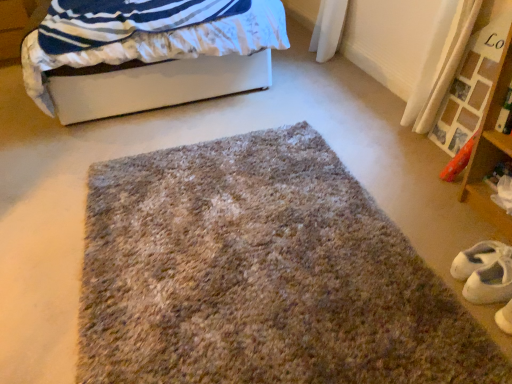
Question: Is white smooth bed at upper left situated inside white suede shoe at lower right or outside?

Choices:
 (A) inside
 (B) outside

Answer: (B)

Question: From a real-world perspective, is white smooth bed at upper left positioned above or below white suede shoe at lower right?

Choices:
 (A) below
 (B) above

Answer: (B)

Question: Estimate the real-world distances between objects in this image. Which object is farther from the white smooth bed at upper left?

Choices:
 (A) white suede shoe at lower right
 (B) wooden shelf at right
 (C) fuzzy carpet at center

Answer: (A)

Question: Which of these objects is positioned closest to the white suede shoe at lower right?

Choices:
 (A) wooden shelf at right
 (B) fuzzy carpet at center
 (C) white smooth bed at upper left

Answer: (A)